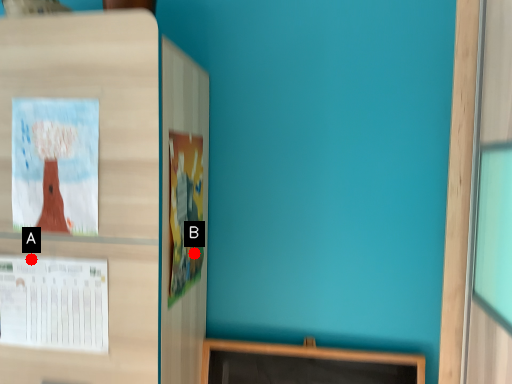
Question: Two points are circled on the image, labeled by A and B beside each circle. Which point appears closest to the camera in this image?

Choices:
 (A) A is closer
 (B) B is closer

Answer: (A)